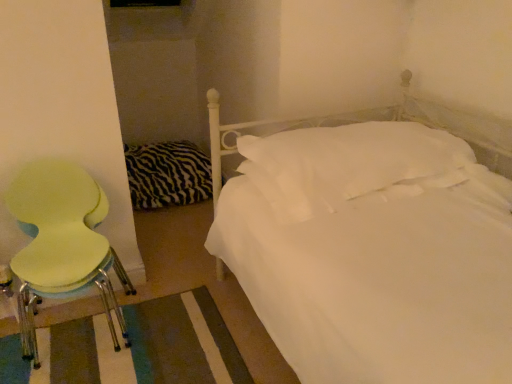
Question: Is white soft pillow at center to the left or to the right of zebra-patterned fabric at left in the image?

Choices:
 (A) left
 (B) right

Answer: (B)

Question: Does point (242, 168) appear closer or farther from the camera than point (169, 167)?

Choices:
 (A) farther
 (B) closer

Answer: (B)

Question: Estimate the real-world distances between objects in this image. Which object is farther from the white soft pillow at center?

Choices:
 (A) light green plastic chair at left
 (B) zebra-patterned fabric at left

Answer: (B)

Question: Considering the real-world distances, which object is closest to the zebra-patterned fabric at left?

Choices:
 (A) white soft pillow at center
 (B) light green plastic chair at left

Answer: (B)